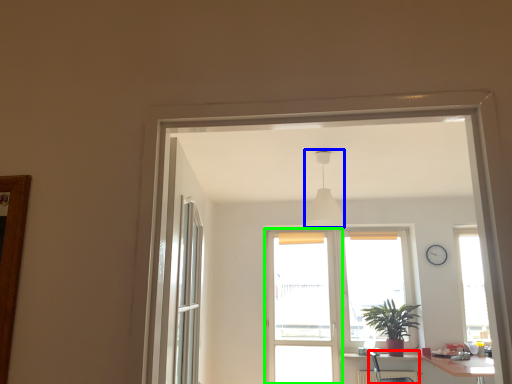
Question: Which object is the farthest from armchair (highlighted by a red box)? Choose among these: light fixture (highlighted by a blue box) or screen door (highlighted by a green box).

Choices:
 (A) light fixture
 (B) screen door

Answer: (A)